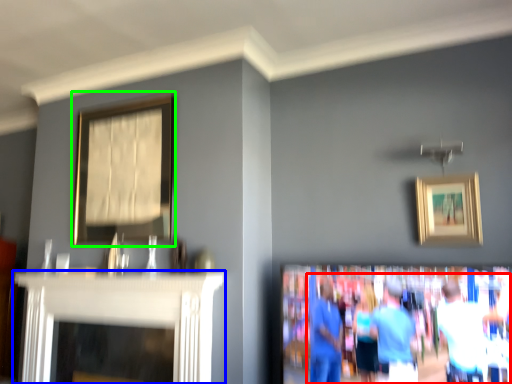
Question: Which is nearer to the couple (highlighted by a red box)? fireplace (highlighted by a blue box) or picture frame (highlighted by a green box).

Choices:
 (A) fireplace
 (B) picture frame

Answer: (A)